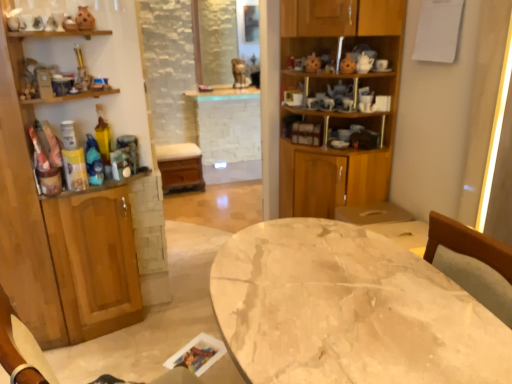
Question: Is wooden cabinet at left, which is the 1th cabinetry in left-to-right order, wider or thinner than marble table at center?

Choices:
 (A) thin
 (B) wide

Answer: (A)

Question: In the image, is wooden cabinet at left, which is the 2th cabinetry from right to left, positioned in front of or behind marble table at center?

Choices:
 (A) behind
 (B) front

Answer: (A)

Question: Estimate the real-world distances between objects in this image. Which object is closer to the wooden cabinet at left, which is the 1th cabinetry in left-to-right order?

Choices:
 (A) wooden cabinet at center, which is counted as the second cabinetry, starting from the left
 (B) marble table at center

Answer: (A)

Question: Considering the real-world distances, which object is closest to the wooden cabinet at left, which is the 1th cabinetry in left-to-right order?

Choices:
 (A) marble table at center
 (B) wooden cabinet at center, the 1th cabinetry when ordered from right to left

Answer: (B)